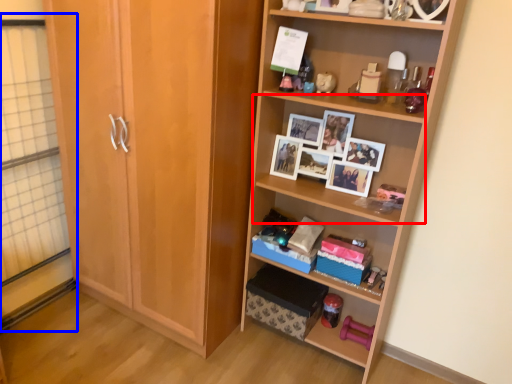
Question: Which object appears closest to the camera in this image, shelf (highlighted by a red box) or glass door (highlighted by a blue box)?

Choices:
 (A) shelf
 (B) glass door

Answer: (B)